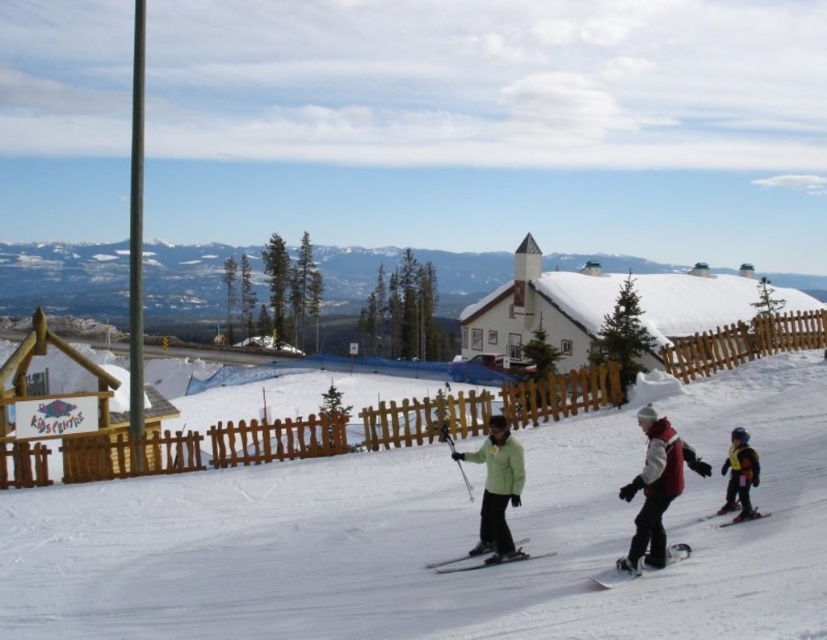
You are a photographer at the ski resort and want to capture a photo that includes both the maroon fleece jacket at center right and the black matte ski at center. Which object should you focus on first if you want to ensure both are in the frame without moving the camera?

The maroon fleece jacket at center right is larger than the black matte ski at center. To include both in the frame, focus on the larger object first, which is the maroon fleece jacket at center right, as it requires more space in the composition.

You are standing at the bottom of the slope and want to locate the maroon fleece jacket at center right. According to the coordinates given, in which direction should you look to find it?

The maroon fleece jacket at center right is located at coordinates point (656, 486). Since the coordinate system is not specified, but assuming standard image coordinates where x increases to the right and y increases downward, you should look towards the upper right direction from your position at the bottom to locate it.

You are planning to place a small flag on the white snow at center and the yellow life vest at lower right. Which location will allow the flag to be more visible to people approaching from the slope? Please explain your reasoning based on the scene description.

The white snow at center is bigger than the yellow life vest at lower right, so placing the flag on the white snow at center would provide a larger and more visible surface area for people approaching from the slope.